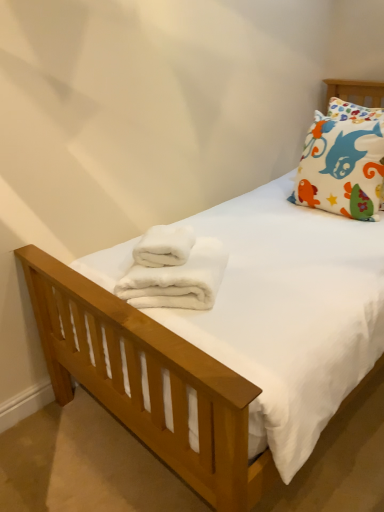
Identify the location of empty space that is ontop of white fluffy bath towel at center, the first bath towel when ordered from top to bottom (from a real-world perspective). Image resolution: width=384 pixels, height=512 pixels. (165, 237).